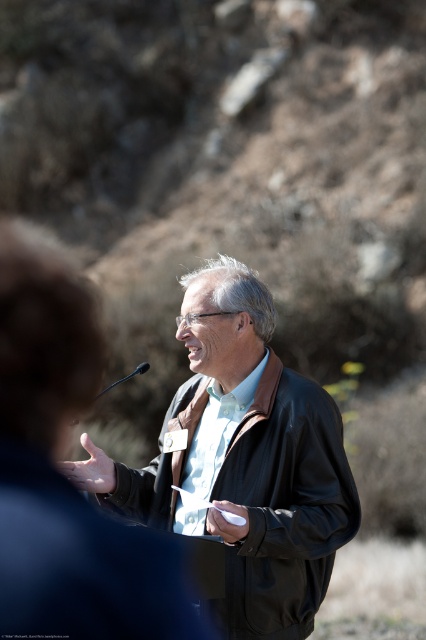
Question: Does black leather jacket at center appear under black plastic microphone at center?

Choices:
 (A) no
 (B) yes

Answer: (B)

Question: Which of the following is the farthest from the observer?

Choices:
 (A) (131, 374)
 (B) (299, 550)

Answer: (A)

Question: Which point is closer to the camera taking this photo?

Choices:
 (A) (120, 381)
 (B) (204, 532)

Answer: (B)

Question: Can you confirm if black leather jacket at center is positioned to the left of black plastic microphone at center?

Choices:
 (A) no
 (B) yes

Answer: (A)

Question: From the image, what is the correct spatial relationship of black leather jacket at center in relation to black plastic microphone at center?

Choices:
 (A) left
 (B) right

Answer: (B)

Question: Which point is closer to the camera taking this photo?

Choices:
 (A) [x=268, y=422]
 (B) [x=108, y=388]

Answer: (A)